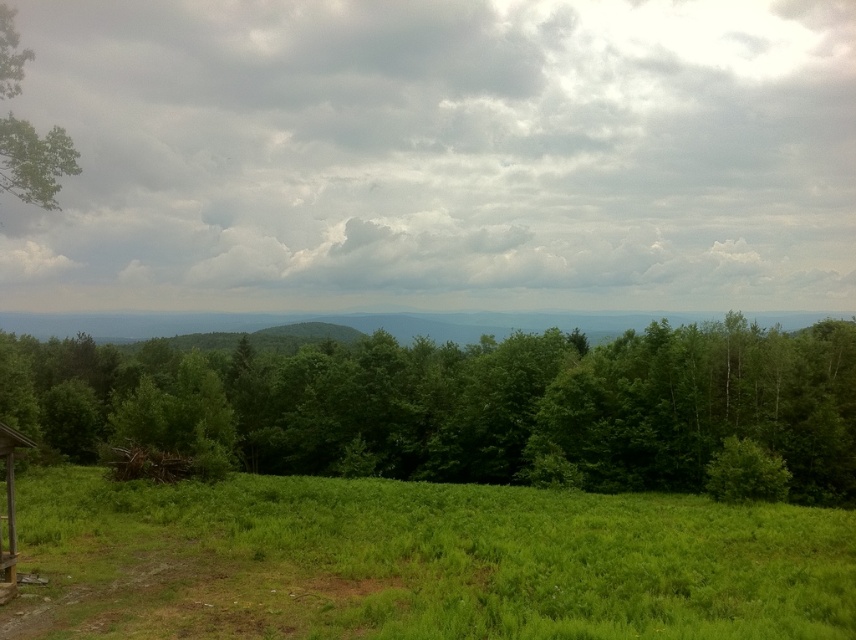
Question: Which of these objects is positioned closest to the green grassy field at lower left?

Choices:
 (A) cloudy sky at upper center
 (B) green leafy tree at center

Answer: (B)

Question: Is cloudy sky at upper center smaller than green leafy tree at center?

Choices:
 (A) yes
 (B) no

Answer: (B)

Question: Among these objects, which one is farthest from the camera?

Choices:
 (A) green leafy tree at upper left
 (B) green leafy tree at center
 (C) cloudy sky at upper center

Answer: (C)

Question: Can you confirm if green grassy field at lower left is positioned to the left of green leafy tree at center?

Choices:
 (A) no
 (B) yes

Answer: (A)

Question: Which point is farther from the camera taking this photo?

Choices:
 (A) (825, 472)
 (B) (642, 556)

Answer: (A)

Question: Where is cloudy sky at upper center located in relation to green leafy tree at center in the image?

Choices:
 (A) left
 (B) right

Answer: (B)